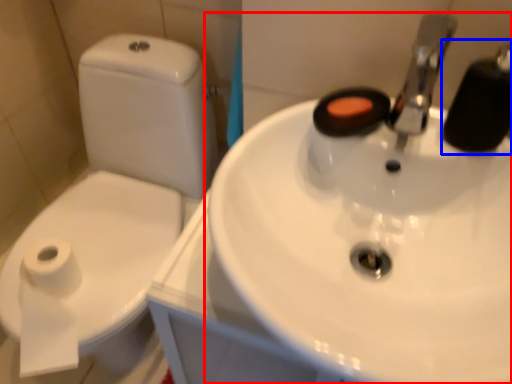
Question: Among these objects, which one is nearest to the camera, sink (highlighted by a red box) or plumbing fixture (highlighted by a blue box)?

Choices:
 (A) sink
 (B) plumbing fixture

Answer: (A)